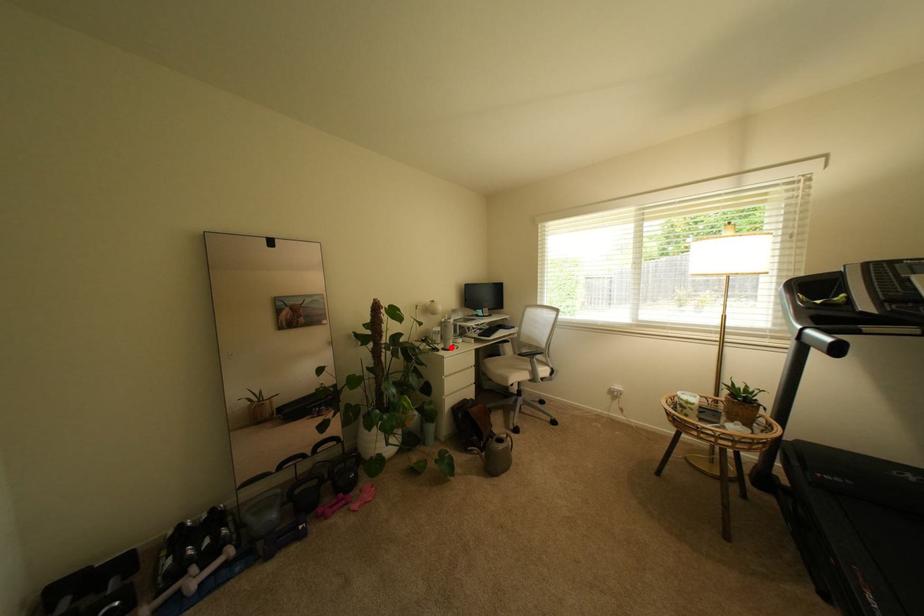
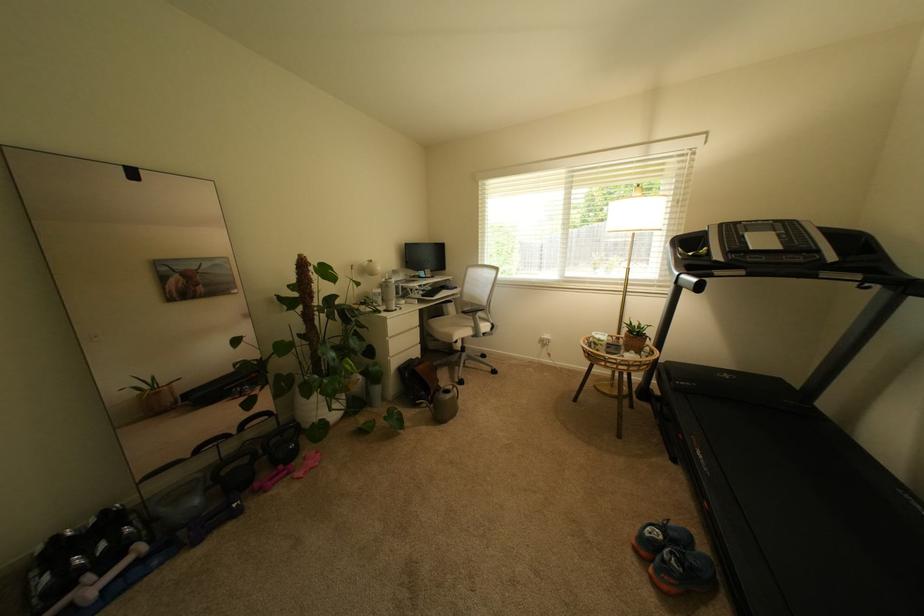
The point at the highlighted location is marked in the first image. Where is the corresponding point in the second image?

(393, 310)